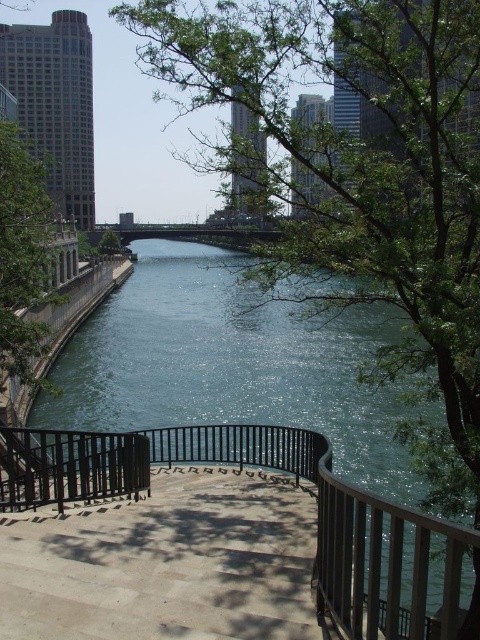
Question: Which of the following is the closest to the observer?

Choices:
 (A) black metal railing at center
 (B) green leafy tree at left
 (C) green leafy tree at center

Answer: (A)

Question: Which point is farther from the camera taking this photo?

Choices:
 (A) (112, 244)
 (B) (33, 218)

Answer: (A)

Question: Which object appears closest to the camera in this image?

Choices:
 (A) black metal railing at center
 (B) green leafy tree at center
 (C) green leafy tree at left

Answer: (A)

Question: Is the position of black metal railing at center less distant than that of green leafy tree at left?

Choices:
 (A) no
 (B) yes

Answer: (B)

Question: Is green leafy tree at left wider than green leafy tree at center?

Choices:
 (A) no
 (B) yes

Answer: (B)

Question: Can you confirm if green leafy tree at left is thinner than green leafy tree at center?

Choices:
 (A) no
 (B) yes

Answer: (A)